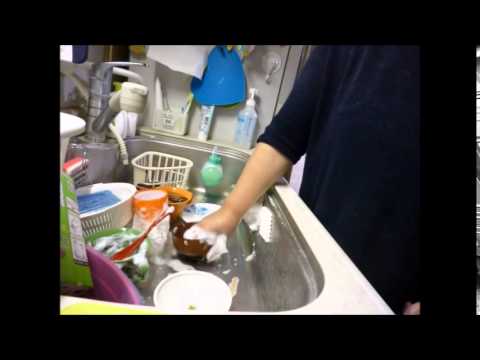
What are the coordinates of `adhesive hook` in the screenshot? It's located at (269, 60).